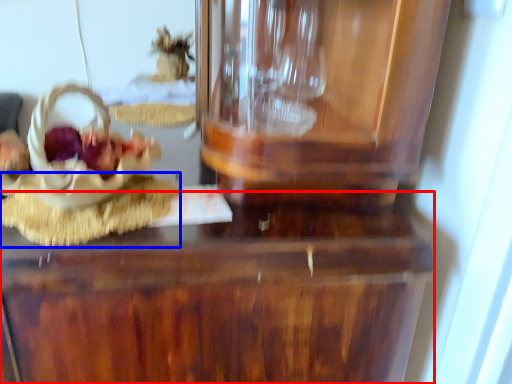
Question: Which object appears farthest to the camera in this image, table (highlighted by a red box) or food (highlighted by a blue box)?

Choices:
 (A) table
 (B) food

Answer: (B)